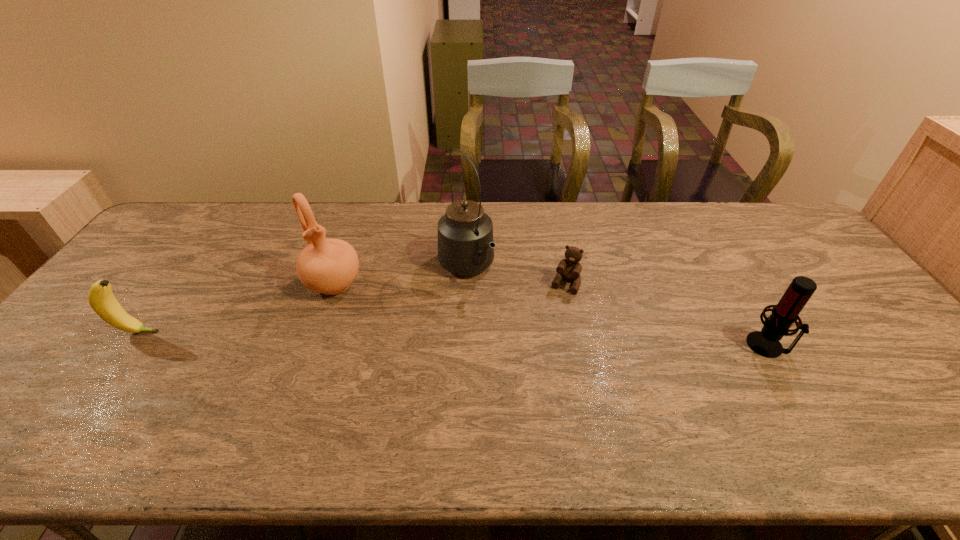
This screenshot has height=540, width=960. Find the location of `vacant point located between the second object from left to right and the microphone`. vacant point located between the second object from left to right and the microphone is located at coordinates (550, 314).

At what (x,y) coordinates should I click in order to perform the action: click on empty location between the second shortest object and the kettle. Please return your answer as a coordinate pair (x, y). The width and height of the screenshot is (960, 540). Looking at the image, I should click on (301, 300).

Image resolution: width=960 pixels, height=540 pixels. What are the coordinates of `free space between the fourth object from left to right and the microphone` in the screenshot? It's located at (666, 315).

The image size is (960, 540). Identify the location of free space between the banana and the microphone. (452, 339).

What are the coordinates of `free spot between the kettle and the second tallest object` in the screenshot? It's located at (399, 275).

You are a GUI agent. You are given a task and a screenshot of the screen. Output one action in this format:
    pyautogui.click(x=<x>, y=<y>)
    Task: Click on the empty space between the third tallest object and the fourth tallest object
    Image resolution: width=960 pixels, height=540 pixels.
    Given the screenshot: What is the action you would take?
    pyautogui.click(x=452, y=339)

Where is `free space between the fourth object from left to right and the banana`? This screenshot has height=540, width=960. free space between the fourth object from left to right and the banana is located at coordinates (351, 308).

Image resolution: width=960 pixels, height=540 pixels. I want to click on object that ranks as the fourth closest to the fourth object from left to right, so click(x=100, y=297).

Select which object is the fourth closest to the third object from left to right. Please provide its 2D coordinates. Your answer should be formatted as a tuple, i.e. [(x, y)], where the tuple contains the x and y coordinates of a point satisfying the conditions above.

[(100, 297)]

The image size is (960, 540). What are the coordinates of `vacant area that satisfies the following two spatial constraints: 1. on the front side of the second object from left to right; 2. on the right side of the fourth object from left to right` in the screenshot? It's located at (333, 285).